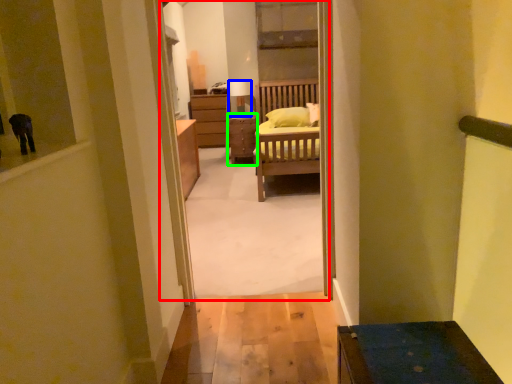
Question: Estimate the real-world distances between objects in this image. Which object is closer to corridor (highlighted by a red box), lamp (highlighted by a blue box) or table (highlighted by a green box)?

Choices:
 (A) lamp
 (B) table

Answer: (A)